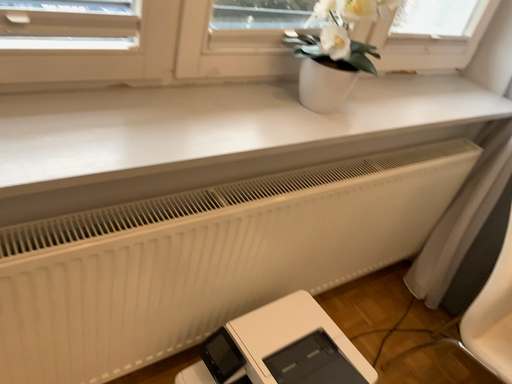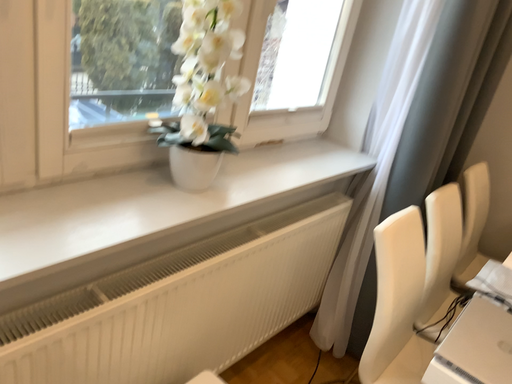
Question: How did the camera likely rotate when shooting the video?

Choices:
 (A) rotated upward
 (B) rotated downward

Answer: (A)